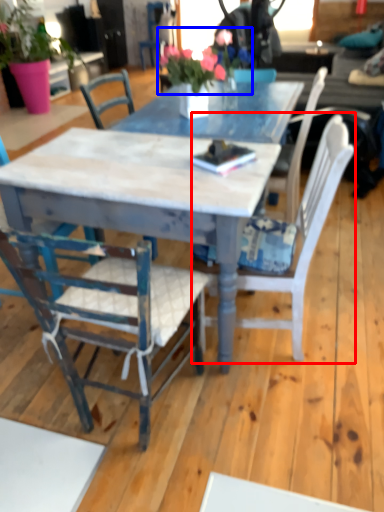
Question: Which object is further to the camera taking this photo, chair (highlighted by a red box) or floral arrangement (highlighted by a blue box)?

Choices:
 (A) chair
 (B) floral arrangement

Answer: (B)